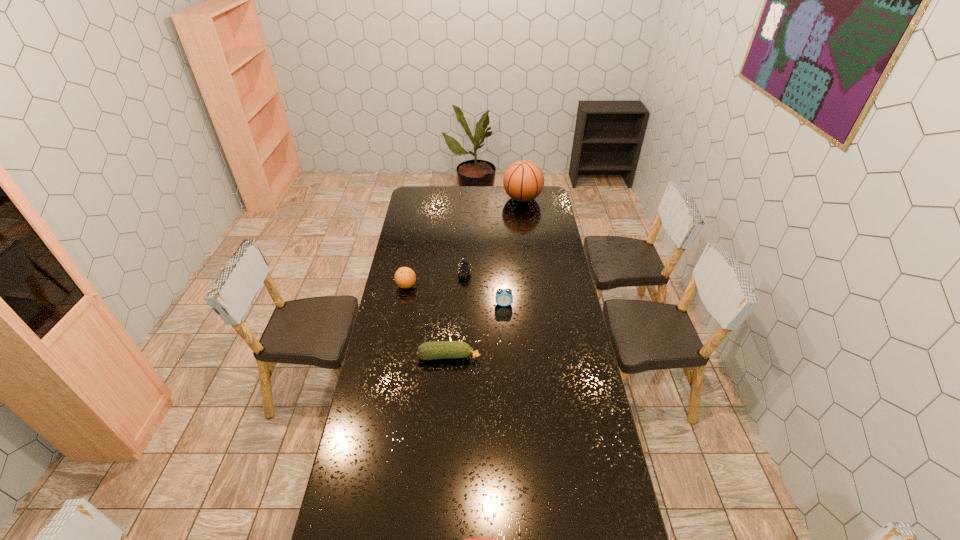
I want to click on the fourth closest object relative to the second shortest object, so click(475, 539).

Where is `object that is the fifth closest to the shortest object`? Image resolution: width=960 pixels, height=540 pixels. object that is the fifth closest to the shortest object is located at coordinates (523, 181).

Locate an element on the screen. This screenshot has width=960, height=540. blank space that satisfies the following two spatial constraints: 1. on the face of the right alarm clock; 2. at the blossom end of the fifth farthest object is located at coordinates (507, 357).

What are the coordinates of `free spot that satisfies the following two spatial constraints: 1. on the front side of the farthest object; 2. at the blossom end of the cucumber` in the screenshot? It's located at (544, 357).